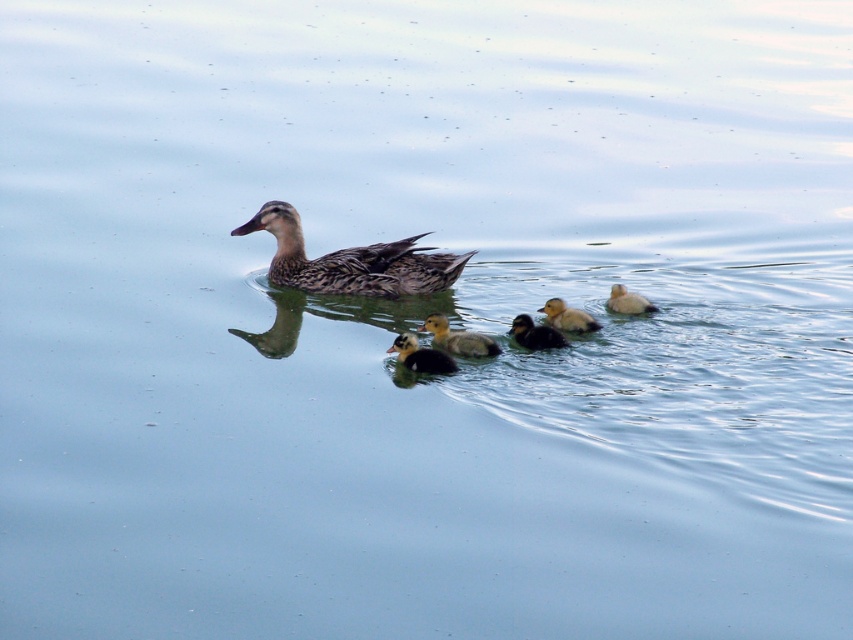
You are a wildlife photographer aiming to capture a closeup shot of the brown fuzzy duckling at center. Given that your camera has a minimum focusing distance of 5 meters, will you be able to take the photo without moving closer?

The brown fuzzy duckling at center is 6.12 meters away from the camera, which is beyond the minimum focusing distance of 5 meters. Therefore, you can take the photo without moving closer.

You are observing a group of ducklings swimming in a pond. You see a black fuzzy duckling at center and a dark brown fuzzy duckling at center. Which duckling is positioned to the left?

The black fuzzy duckling at center is positioned to the left of the dark brown fuzzy duckling at center.